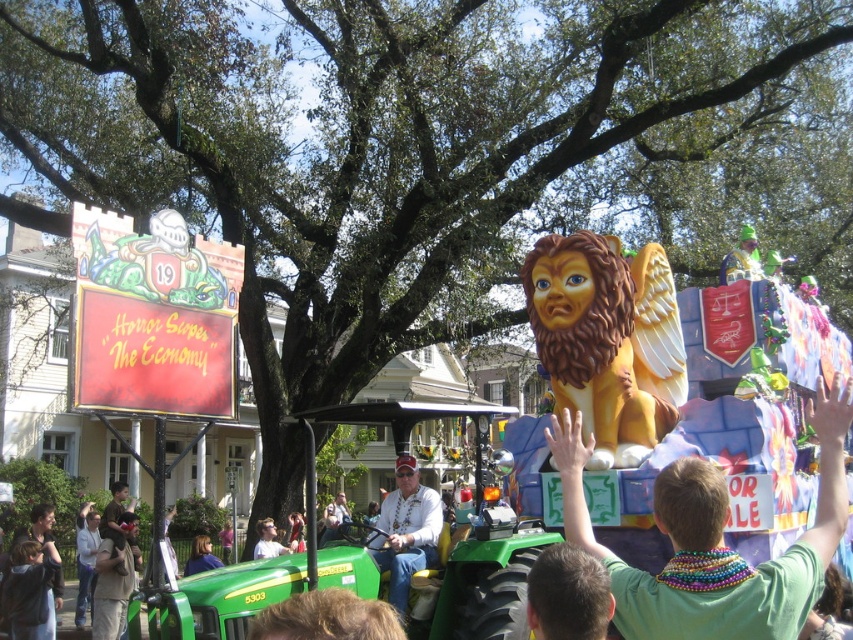
Question: Among these points, which one is farthest from the camera?

Choices:
 (A) click(693, 465)
 (B) click(376, 536)
 (C) click(587, 288)

Answer: (C)

Question: Which object is closer to the camera taking this photo?

Choices:
 (A) golden matte lion at center
 (B) light brown leather jacket at center
 (C) green jersey at center

Answer: (C)

Question: Which point appears closest to the camera in this image?

Choices:
 (A) (676, 592)
 (B) (602, 412)
 (C) (265, 550)
 (D) (436, 532)

Answer: (A)

Question: Can you confirm if golden matte lion at center is positioned to the right of light brown leather jacket at center?

Choices:
 (A) no
 (B) yes

Answer: (B)

Question: Does golden matte lion at center appear on the right side of light brown leather jacket at center?

Choices:
 (A) yes
 (B) no

Answer: (A)

Question: Can you confirm if golden matte lion at center is positioned to the right of matte white shirt at center?

Choices:
 (A) no
 (B) yes

Answer: (B)